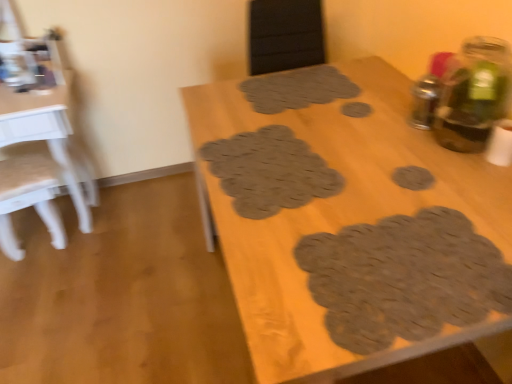
You are a GUI agent. You are given a task and a screenshot of the screen. Output one action in this format:
    pyautogui.click(x=<x>, y=<y>)
    Task: Click on the vacant area that lies in front of brown textured coaster at center-right, which ranks as the third footprint in back-to-front order
    
    Given the screenshot: What is the action you would take?
    pyautogui.click(x=436, y=227)